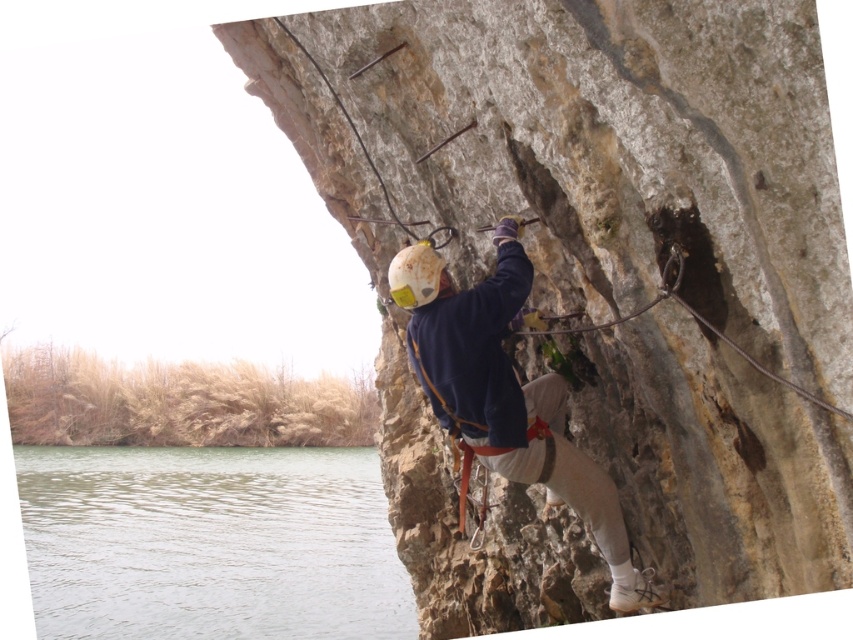
Question: Among these points, which one is nearest to the camera?

Choices:
 (A) (428, 272)
 (B) (134, 481)
 (C) (543, 236)
 (D) (523, 436)

Answer: (D)

Question: Does natural stone rock climber at center appear on the left side of dark blue fleece jacket at center?

Choices:
 (A) no
 (B) yes

Answer: (B)

Question: Is natural stone rock climber at center below dark blue fleece jacket at center?

Choices:
 (A) yes
 (B) no

Answer: (B)

Question: Can you confirm if natural stone rock climber at center is positioned below greenish water at lower left?

Choices:
 (A) no
 (B) yes

Answer: (A)

Question: Which point is farther to the camera?

Choices:
 (A) (442, 360)
 (B) (62, 454)
 (C) (437, 284)

Answer: (B)

Question: Which object is the closest to the dark blue fleece jacket at center?

Choices:
 (A) natural stone rock climber at center
 (B) white matte helmet at center
 (C) greenish water at lower left

Answer: (B)